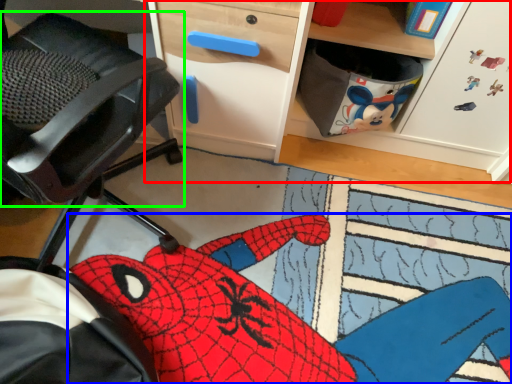
Question: Which is farther away from computer desk (highlighted by a red box)? animal (highlighted by a blue box) or chair (highlighted by a green box)?

Choices:
 (A) animal
 (B) chair

Answer: (A)